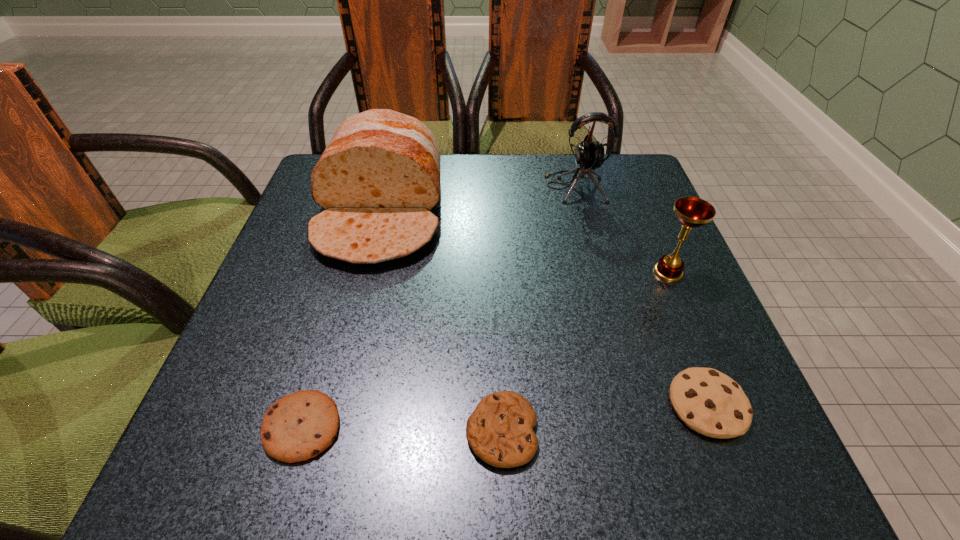
Where is `object located in the far left corner section of the desktop`? This screenshot has width=960, height=540. object located in the far left corner section of the desktop is located at coordinates (378, 179).

Where is `object that is at the near left corner`? The height and width of the screenshot is (540, 960). object that is at the near left corner is located at coordinates (297, 427).

The image size is (960, 540). I want to click on object that is at the far right corner, so click(589, 156).

The image size is (960, 540). Identify the location of object that is positioned at the near right corner. tap(709, 402).

This screenshot has width=960, height=540. I want to click on vacant point at the far edge, so click(x=517, y=181).

At what (x,y) coordinates should I click in order to perform the action: click on vacant space at the near edge of the desktop. Please return your answer as a coordinate pair (x, y). This screenshot has height=540, width=960. Looking at the image, I should click on (473, 465).

Identify the location of free space at the left edge of the desktop. This screenshot has width=960, height=540. (292, 357).

In order to click on free region at the right edge of the desktop in this screenshot , I will do `click(694, 303)`.

The image size is (960, 540). What are the coordinates of `vacant space at the near left corner of the desktop` in the screenshot? It's located at (224, 444).

In the image, there is a desktop. Where is `vacant region at the far right corner`? Image resolution: width=960 pixels, height=540 pixels. vacant region at the far right corner is located at coordinates (622, 196).